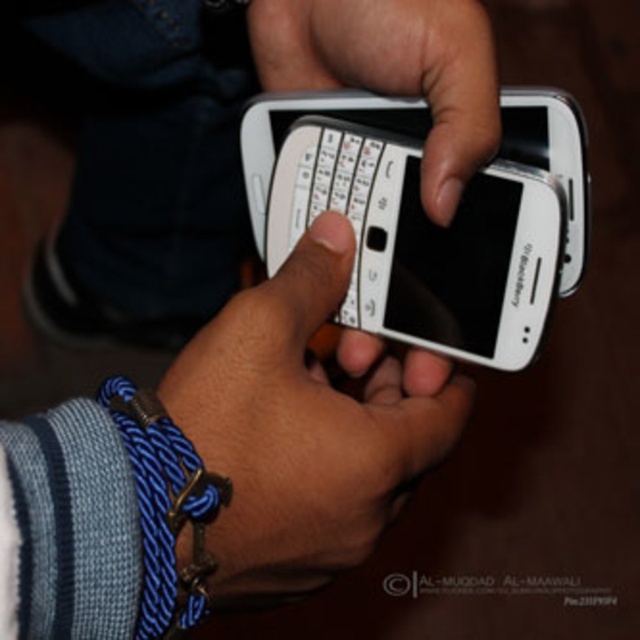
Consider the image. Based on the scene description, can you determine which object is wider between the white matte phone at center and the black matte text at center?

The black matte text at center is wider than the white matte phone at center.

You are trying to decide which phone to use for a quick text. You have two phones in front of you, the white glossy phone at center and the white plastic phone at center. Based on their sizes, which one might be easier to hold comfortably?

The white glossy phone at center is taller than the white plastic phone at center, so it might provide a better grip and be easier to hold comfortably for typing.